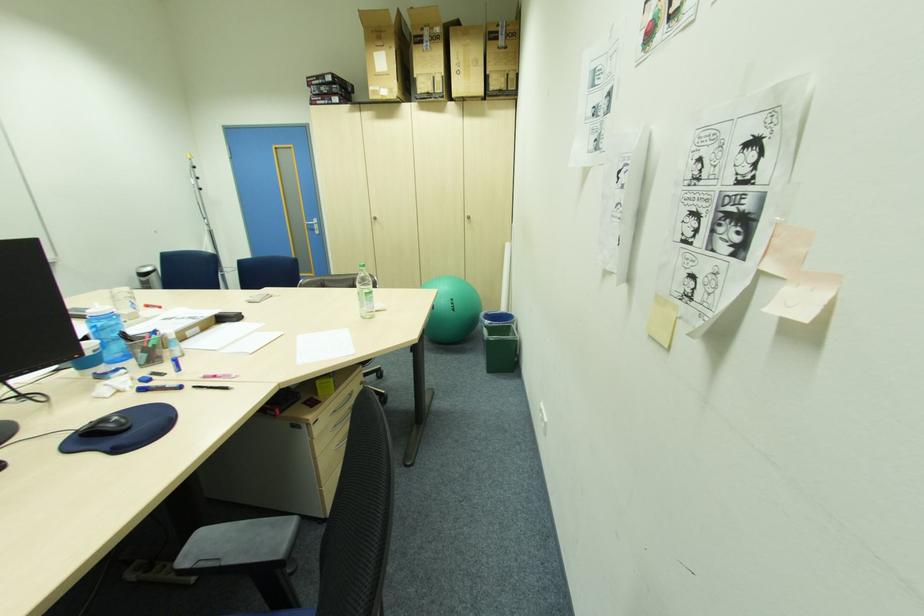
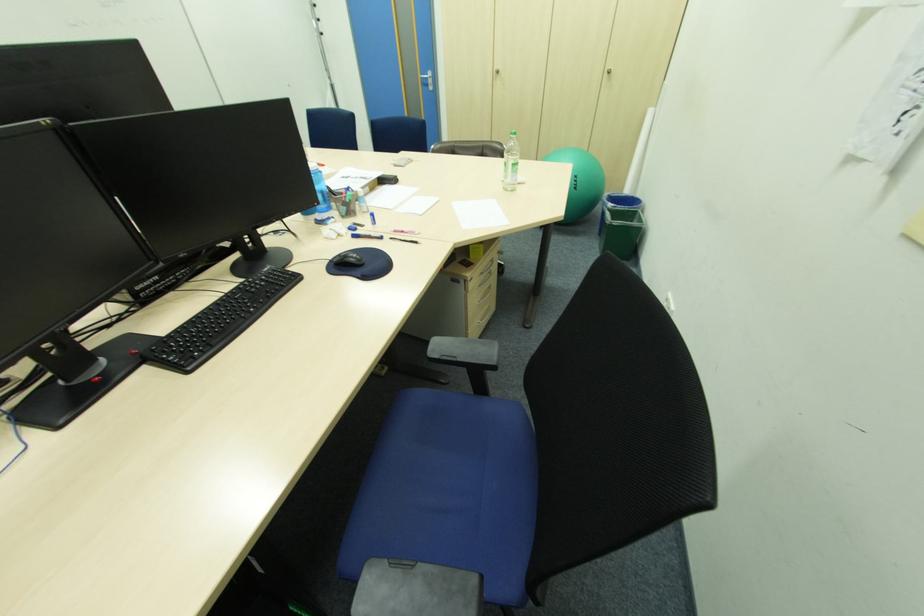
The point at [368,317] is marked in the first image. Where is the corresponding point in the second image?

(511, 190)